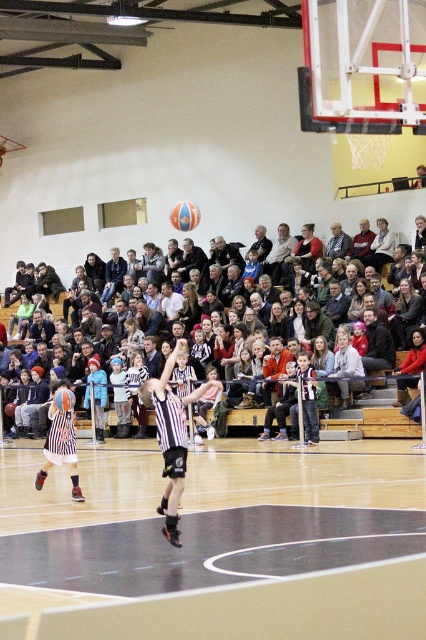
Question: Which object is farther from the camera taking this photo?

Choices:
 (A) black jersey at center
 (B) striped jersey at center
 (C) orange matte basketball at center
 (D) black rubber court at center

Answer: (C)

Question: Considering the real-world distances, which object is farthest from the black jersey at center?

Choices:
 (A) matte black jacket at upper center
 (B) orange matte basketball at center
 (C) black rubber court at center
 (D) striped jersey at center

Answer: (B)

Question: Which point is closer to the camera?

Choices:
 (A) dark blue jacket at center
 (B) orange textured basketball at center
 (C) striped jersey at center
 (D) black jersey at center

Answer: (D)

Question: Is black jersey at center smaller than matte black jacket at upper center?

Choices:
 (A) yes
 (B) no

Answer: (A)

Question: Is black jersey at center below orange textured basketball at center?

Choices:
 (A) no
 (B) yes

Answer: (B)

Question: From the image, what is the correct spatial relationship of black rubber court at center in relation to orange matte basketball at center?

Choices:
 (A) above
 (B) below

Answer: (B)